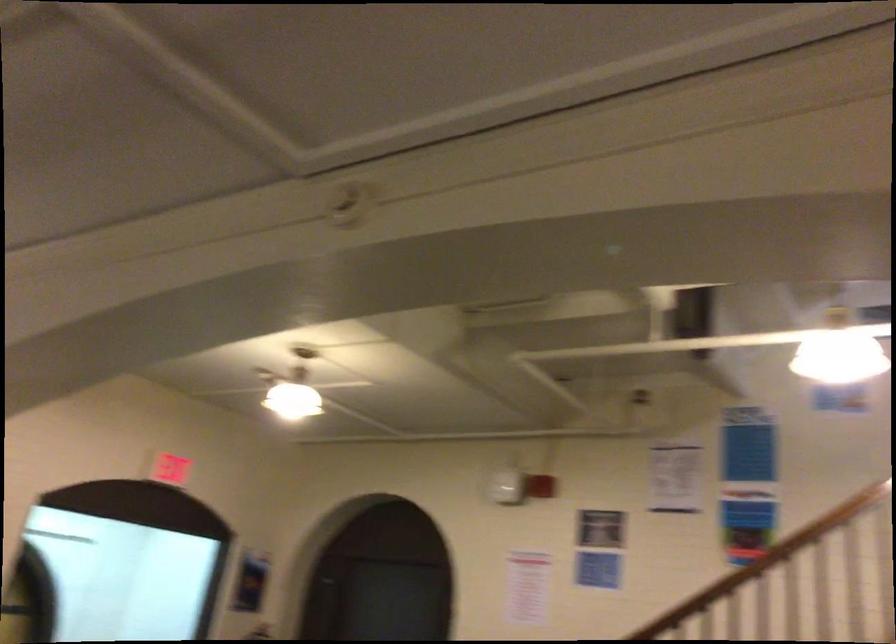
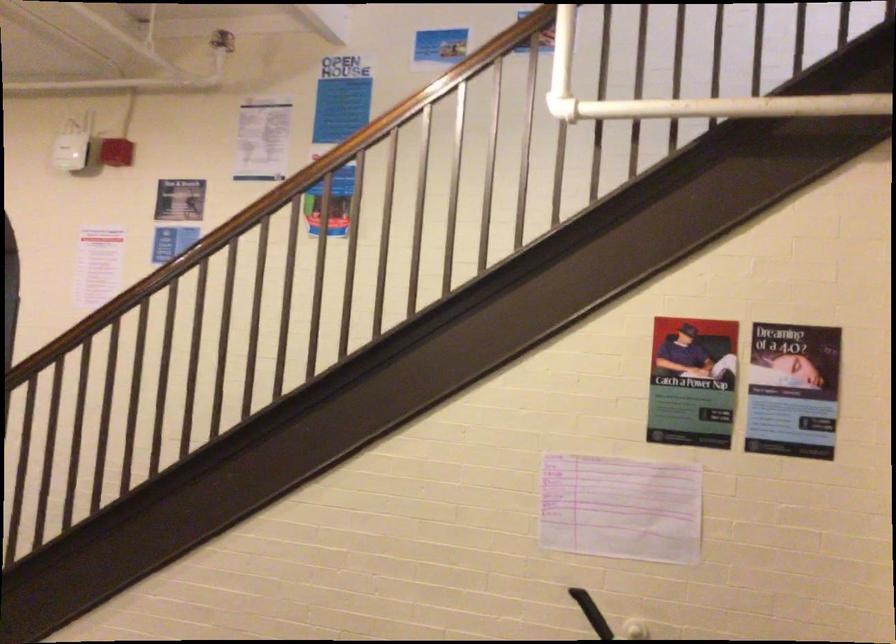
Where in the second image is the point corresponding to (x=549, y=536) from the first image?

(108, 154)